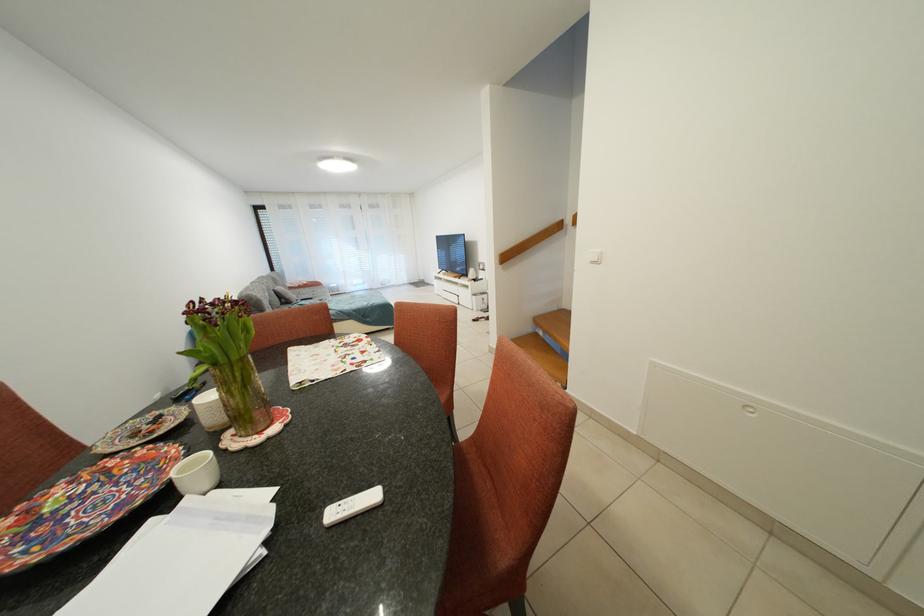
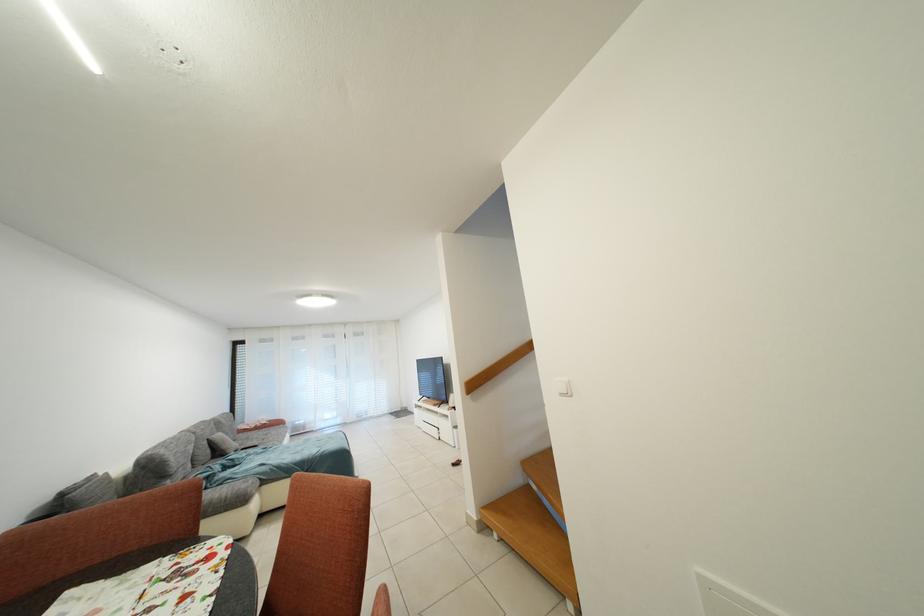
Find the pixel in the second image that matches the point at 293,305 in the first image.

(226, 456)